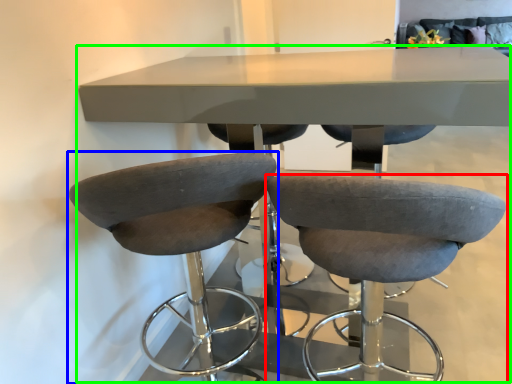
Question: Estimate the real-world distances between objects in this image. Which object is farther from chair (highlighted by a red box), chair (highlighted by a blue box) or table (highlighted by a green box)?

Choices:
 (A) chair
 (B) table

Answer: (B)